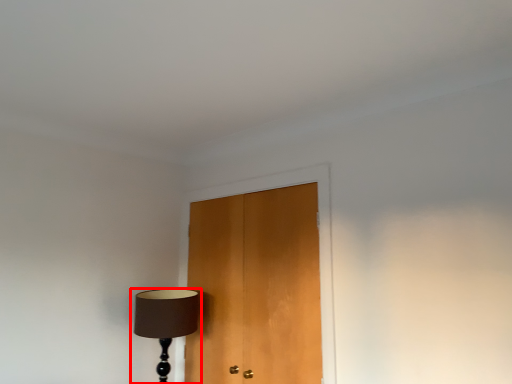
Question: From the image's perspective, where is lamp (annotated by the red box) located relative to door?

Choices:
 (A) below
 (B) above

Answer: (A)